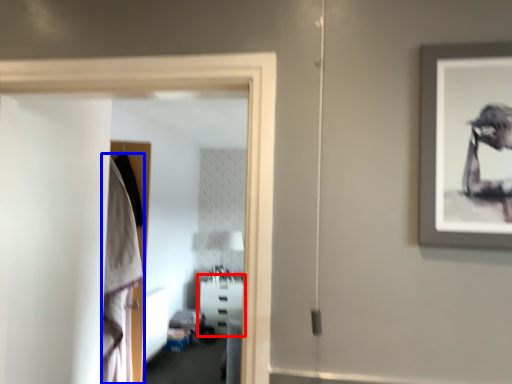
Question: Among these objects, which one is farthest to the camera, furniture (highlighted by a red box) or robe (highlighted by a blue box)?

Choices:
 (A) furniture
 (B) robe

Answer: (A)